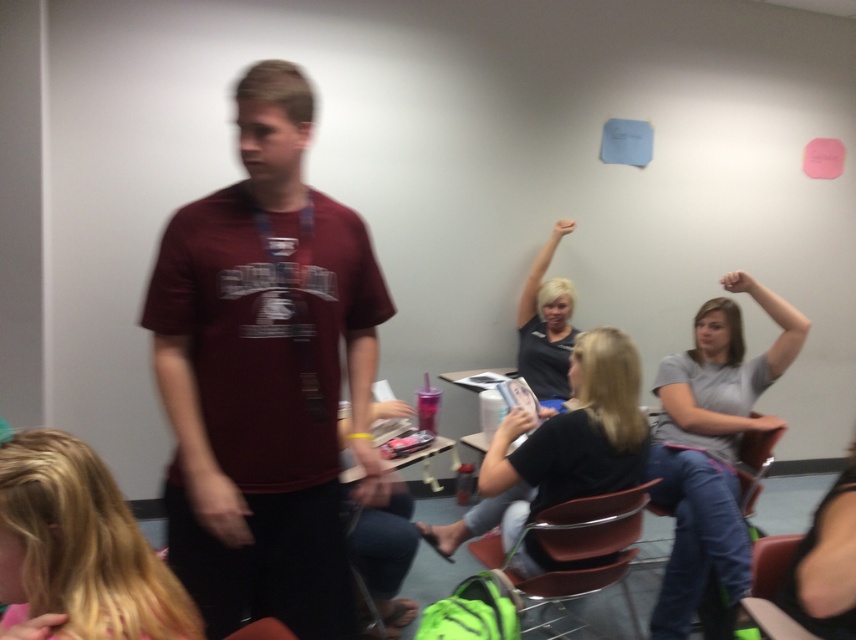
Who is taller, matte skin hand at upper right or pink matte hand at upper center?

With more height is pink matte hand at upper center.

Does matte skin hand at upper right have a greater width compared to pink matte hand at upper center?

Yes, matte skin hand at upper right is wider than pink matte hand at upper center.

You are a GUI agent. You are given a task and a screenshot of the screen. Output one action in this format:
    pyautogui.click(x=<x>, y=<y>)
    Task: Click on the matte skin hand at upper right
    
    Given the screenshot: What is the action you would take?
    pyautogui.click(x=739, y=282)

Does gray matte shirt at lower right come in front of pink matte hand at upper center?

Yes, gray matte shirt at lower right is in front of pink matte hand at upper center.

Measure the distance between gray matte shirt at lower right and pink matte hand at upper center.

1.47 meters

Who is more forward, (771, 308) or (568, 224)?

Point (771, 308) is more forward.

Image resolution: width=856 pixels, height=640 pixels. I want to click on gray matte shirt at lower right, so click(711, 449).

Does matte plastic chair at lower right have a lesser height compared to matte skin hand at upper right?

Incorrect, matte plastic chair at lower right's height does not fall short of matte skin hand at upper right's.

Does point (795, 627) come farther from viewer compared to point (744, 276)?

No, (795, 627) is in front of (744, 276).

Who is more distant from viewer, (770, 564) or (733, 273)?

Positioned behind is point (733, 273).

At what (x,y) coordinates should I click in order to perform the action: click on matte plastic chair at lower right. Please return your answer as a coordinate pair (x, y). This screenshot has height=640, width=856. Looking at the image, I should click on [771, 588].